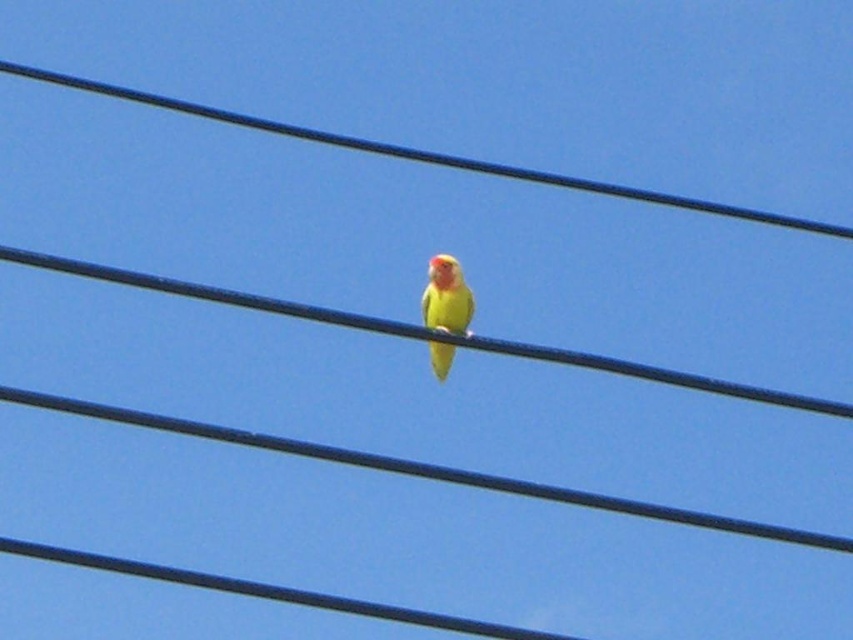
Is point (149, 104) positioned behind point (428, 323)?

Yes, point (149, 104) is behind point (428, 323).

Does black wire at center have a greater height compared to yellow matte parrot at center?

Yes.

Between point (550, 182) and point (451, 346), which one is positioned behind?

Positioned behind is point (451, 346).

Locate an element on the screen. The image size is (853, 640). black wire at center is located at coordinates (422, 154).